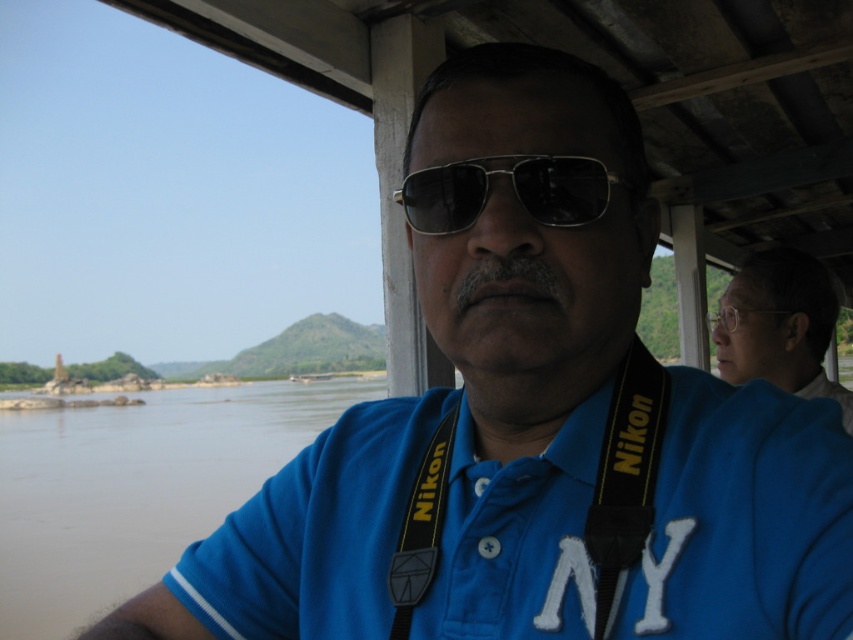
You are standing on the wooden deck and want to take a photo of the brown muddy water at lower left and the metallic reflective sunglasses at center. Which object is wider in the image?

The brown muddy water at lower left might be wider than the metallic reflective sunglasses at center.

You are a photographer standing on a wooden deck with the Nikon camera strap around your neck. You notice the brown muddy water at lower left and the black fabric nikon strap at center. Which object is taller in the scene?

The brown muddy water at lower left has a greater height compared to the black fabric nikon strap at center, so the brown muddy water at lower left is taller in the scene.

You are a photographer trying to capture the perfect shot of the ruins on the island. You have two points marked in your viewfinder at coordinates point [602,474] and point [787,262]. Which point is closer to your camera lens?

Point [602,474] is closer to the camera lens than point [787,262].